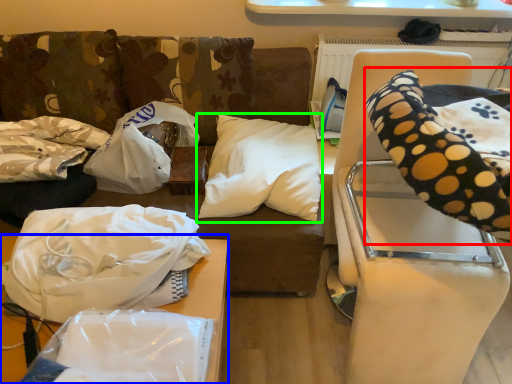
Question: Estimate the real-world distances between objects in this image. Which object is farther from bean bag chair (highlighted by a red box), furniture (highlighted by a blue box) or pillow (highlighted by a green box)?

Choices:
 (A) furniture
 (B) pillow

Answer: (A)